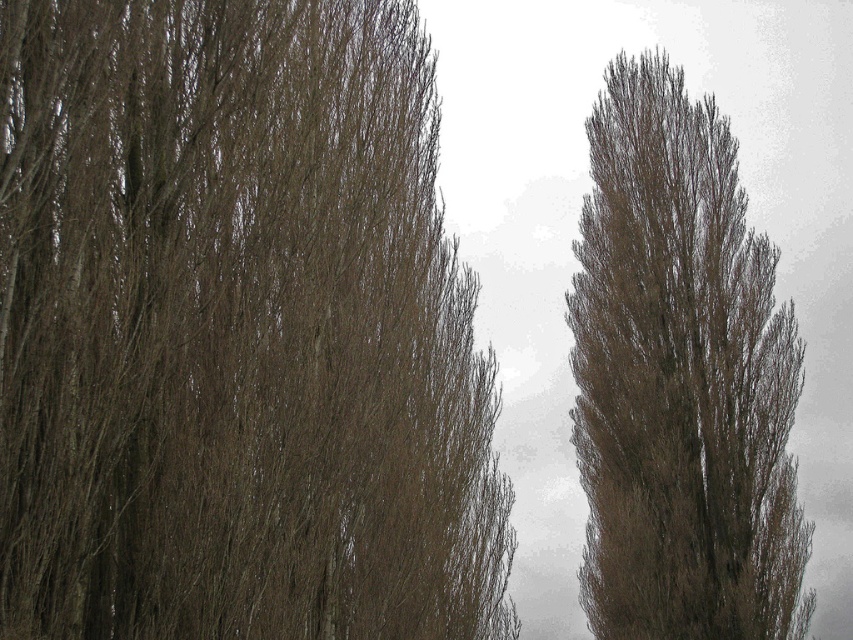
You are an artist sketching the scene and want to ensure accurate proportions. Which tree, the brown textured tree at center or the brown textured tree at right, should you draw first to maintain the correct size relationship?

The brown textured tree at center is smaller than the brown textured tree at right. Therefore, you should draw the brown textured tree at center first, as it is smaller, and then the larger tree at the right to maintain the correct size relationship.